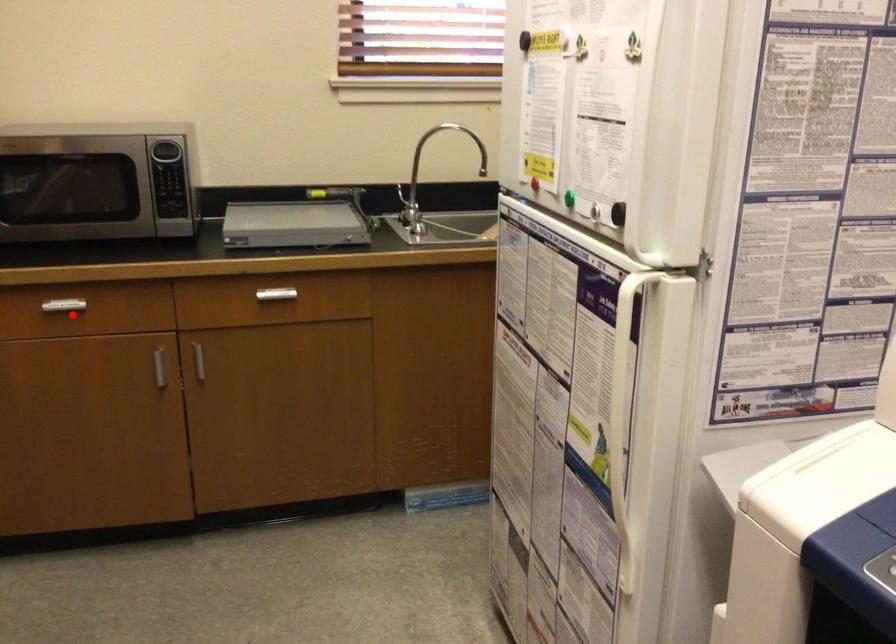
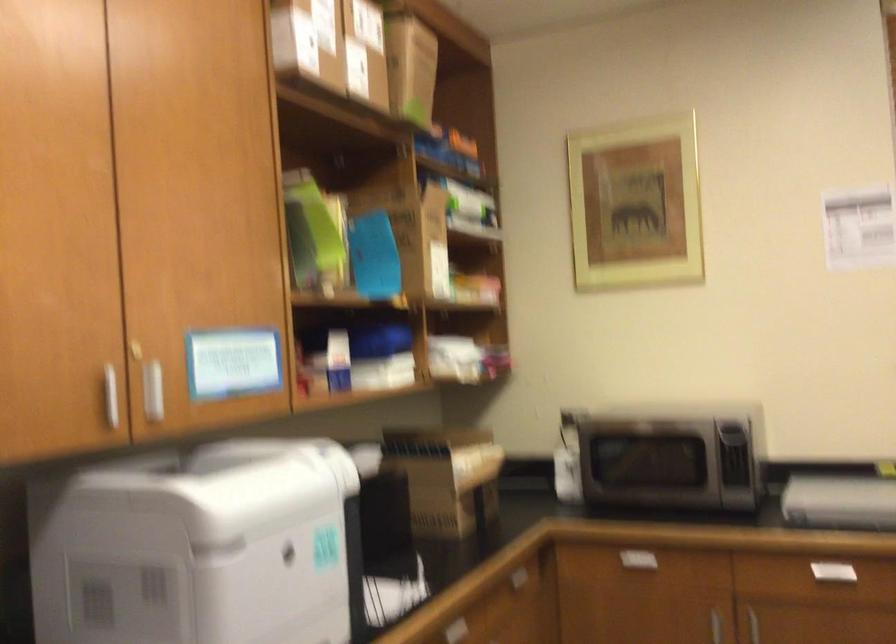
The point at the highlighted location is marked in the first image. Where is the corresponding point in the second image?

(634, 565)